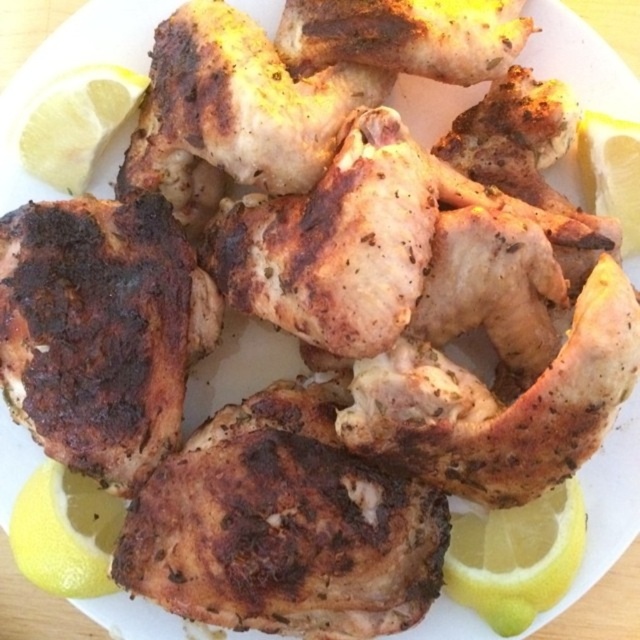
Question: Is yellow matte lemon at lower right above yellow matte lemon at right?

Choices:
 (A) no
 (B) yes

Answer: (A)

Question: Which of the following is the farthest from the observer?

Choices:
 (A) (64, 108)
 (B) (499, 544)

Answer: (B)

Question: Observing the image, what is the correct spatial positioning of yellow matte lemon at lower right in reference to yellow matte lemon at lower left?

Choices:
 (A) left
 (B) right

Answer: (B)

Question: Which of the following is the closest to the observer?

Choices:
 (A) (468, 556)
 (B) (586, 116)
 (C) (17, 563)

Answer: (C)

Question: In this image, where is yellow matte lemon at lower right located relative to yellow matte lemon at right?

Choices:
 (A) left
 (B) right

Answer: (A)

Question: Which point is farther to the camera?

Choices:
 (A) (106, 100)
 (B) (525, 561)

Answer: (A)